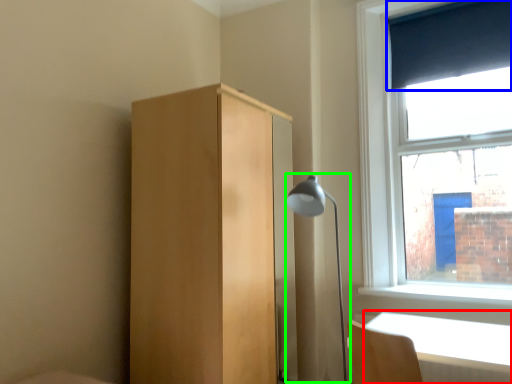
Question: Which is nearer to the table (highlighted by a red box)? curtain (highlighted by a blue box) or lamp (highlighted by a green box).

Choices:
 (A) curtain
 (B) lamp

Answer: (B)